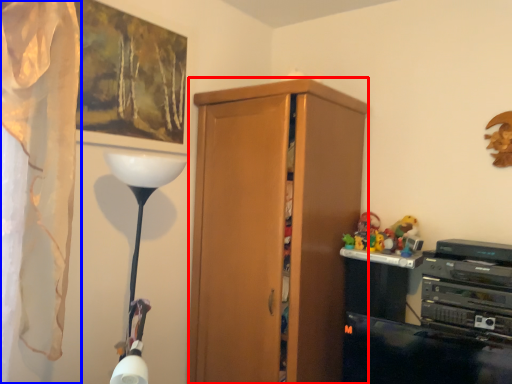
Question: Among these objects, which one is farthest to the camera, cabinetry (highlighted by a red box) or curtain (highlighted by a blue box)?

Choices:
 (A) cabinetry
 (B) curtain

Answer: (A)